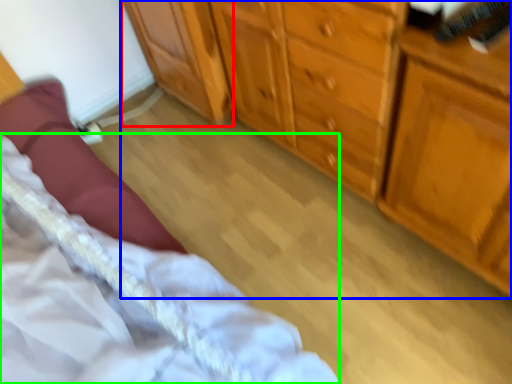
Question: Based on their relative distances, which object is nearer to cabinetry (highlighted by a red box)? Choose from chest of drawers (highlighted by a blue box) and bed (highlighted by a green box).

Choices:
 (A) chest of drawers
 (B) bed

Answer: (A)